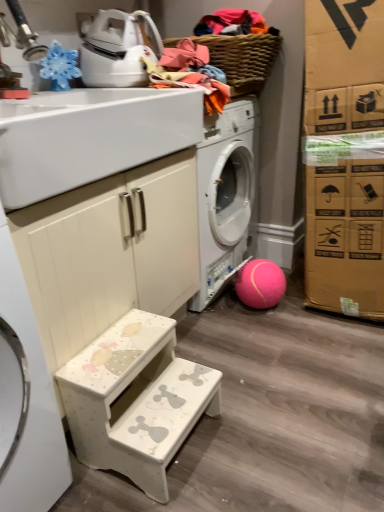
Question: Is white glossy sink at upper left inside woven brown basket at upper center?

Choices:
 (A) yes
 (B) no

Answer: (B)

Question: From the image's perspective, is woven brown basket at upper center located above white glossy sink at upper left?

Choices:
 (A) yes
 (B) no

Answer: (A)

Question: Considering the relative sizes of woven brown basket at upper center and white glossy sink at upper left in the image provided, is woven brown basket at upper center smaller than white glossy sink at upper left?

Choices:
 (A) yes
 (B) no

Answer: (A)

Question: From the image's perspective, would you say woven brown basket at upper center is shown under white glossy sink at upper left?

Choices:
 (A) no
 (B) yes

Answer: (A)

Question: Is woven brown basket at upper center taller than white glossy sink at upper left?

Choices:
 (A) yes
 (B) no

Answer: (B)

Question: From the image's perspective, relative to white glossy sink at upper left, is white painted wood cabinet at lower left above or below?

Choices:
 (A) below
 (B) above

Answer: (A)

Question: Looking at the image, does white painted wood cabinet at lower left seem bigger or smaller compared to white glossy sink at upper left?

Choices:
 (A) big
 (B) small

Answer: (A)

Question: In the image, is white painted wood cabinet at lower left positioned in front of or behind white glossy sink at upper left?

Choices:
 (A) front
 (B) behind

Answer: (B)

Question: Visually, is white painted wood cabinet at lower left positioned to the left or to the right of white glossy sink at upper left?

Choices:
 (A) left
 (B) right

Answer: (B)

Question: Is pink rubber ball at lower right inside or outside of woven brown basket at upper center?

Choices:
 (A) inside
 (B) outside

Answer: (B)

Question: From the image's perspective, is pink rubber ball at lower right above or below woven brown basket at upper center?

Choices:
 (A) above
 (B) below

Answer: (B)

Question: Considering the positions of pink rubber ball at lower right and woven brown basket at upper center in the image, is pink rubber ball at lower right taller or shorter than woven brown basket at upper center?

Choices:
 (A) tall
 (B) short

Answer: (A)

Question: From a real-world perspective, relative to woven brown basket at upper center, is pink rubber ball at lower right vertically above or below?

Choices:
 (A) below
 (B) above

Answer: (A)

Question: Which is correct: white glossy sink at upper left is inside white painted wood step stool at lower left, or outside of it?

Choices:
 (A) inside
 (B) outside

Answer: (B)

Question: In the image, is white glossy sink at upper left on the left side or the right side of white painted wood step stool at lower left?

Choices:
 (A) left
 (B) right

Answer: (A)